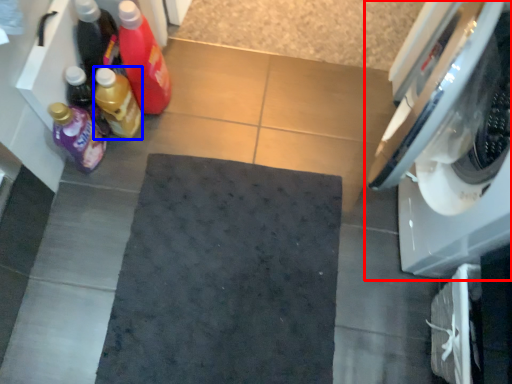
Question: Among these objects, which one is nearest to the camera, washing machine (highlighted by a red box) or bottle (highlighted by a blue box)?

Choices:
 (A) washing machine
 (B) bottle

Answer: (A)